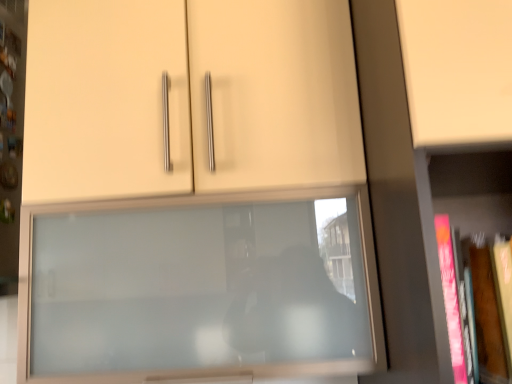
Question: Is hardcover book at right taller than matte glass cupboard at center?

Choices:
 (A) yes
 (B) no

Answer: (B)

Question: Does hardcover book at right lie behind matte glass cupboard at center?

Choices:
 (A) no
 (B) yes

Answer: (A)

Question: Would you consider hardcover book at right to be distant from matte glass cupboard at center?

Choices:
 (A) yes
 (B) no

Answer: (B)

Question: From a real-world perspective, is hardcover book at right located higher than matte glass cupboard at center?

Choices:
 (A) yes
 (B) no

Answer: (B)

Question: Can you confirm if hardcover book at right is wider than matte glass cupboard at center?

Choices:
 (A) no
 (B) yes

Answer: (A)

Question: From the image's perspective, is hardcover book at right on matte glass cupboard at center?

Choices:
 (A) yes
 (B) no

Answer: (B)

Question: From the image's perspective, would you say matte glass cupboard at center is shown under pink matte book at right?

Choices:
 (A) no
 (B) yes

Answer: (B)

Question: From a real-world perspective, is matte glass cupboard at center on pink matte book at right?

Choices:
 (A) no
 (B) yes

Answer: (B)

Question: From a real-world perspective, is matte glass cupboard at center under pink matte book at right?

Choices:
 (A) yes
 (B) no

Answer: (B)

Question: Is matte glass cupboard at center bigger than pink matte book at right?

Choices:
 (A) no
 (B) yes

Answer: (A)

Question: Is matte glass cupboard at center placed right next to pink matte book at right?

Choices:
 (A) yes
 (B) no

Answer: (B)

Question: Does matte glass cupboard at center have a smaller size compared to pink matte book at right?

Choices:
 (A) no
 (B) yes

Answer: (B)

Question: From the image's perspective, is pink matte book at right on hardcover book at right?

Choices:
 (A) yes
 (B) no

Answer: (A)